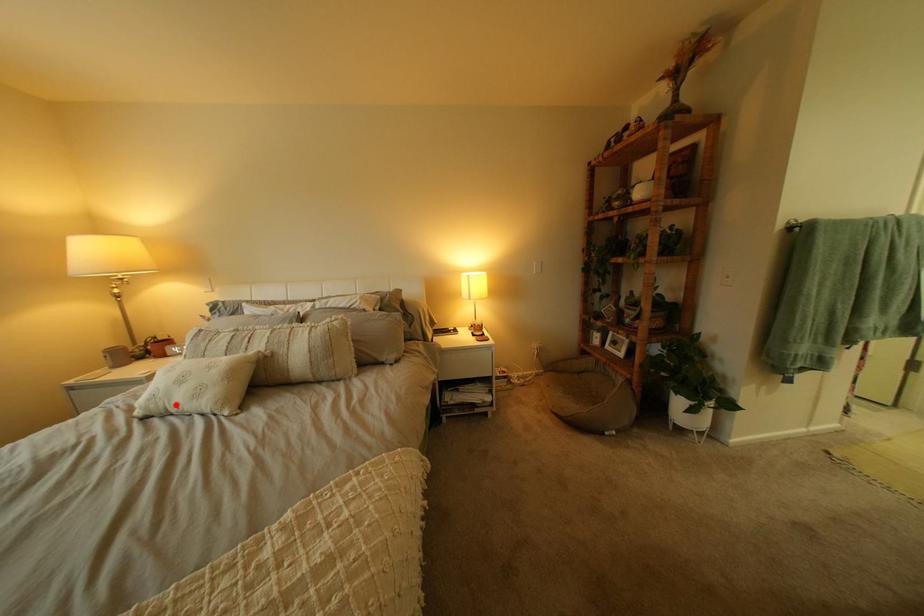
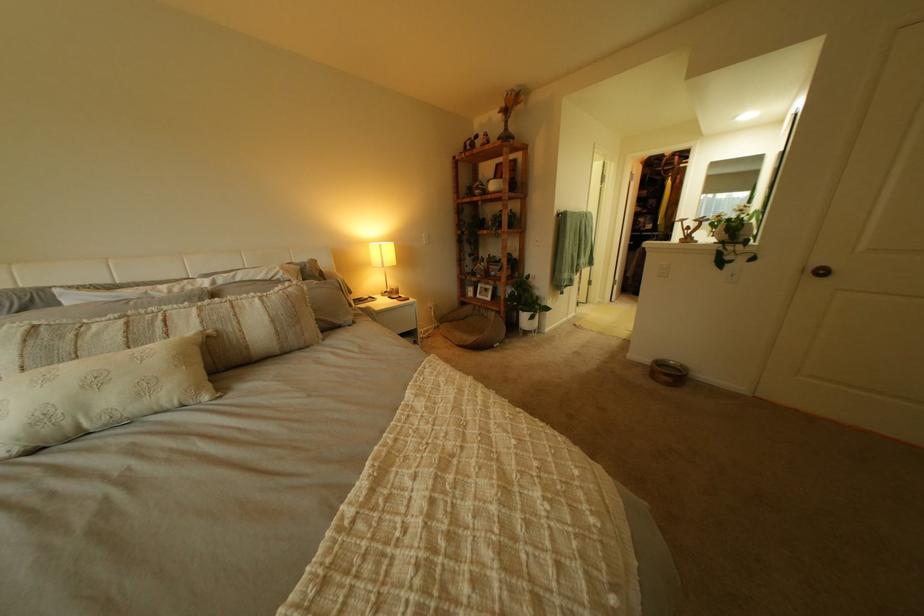
Find the pixel in the second image that matches the highlighted location in the first image.

(80, 424)